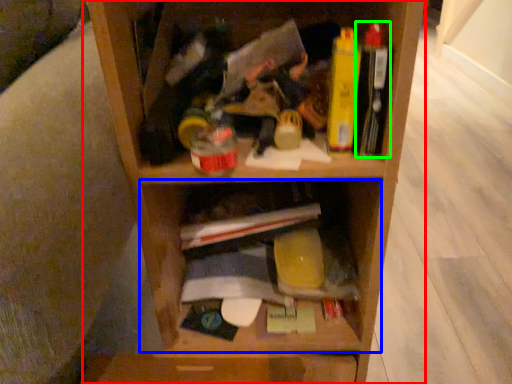
Question: Which object is positioned closest to shelf (highlighted by a red box)? Select from cabinet (highlighted by a blue box) and book (highlighted by a green box).

Choices:
 (A) cabinet
 (B) book

Answer: (A)